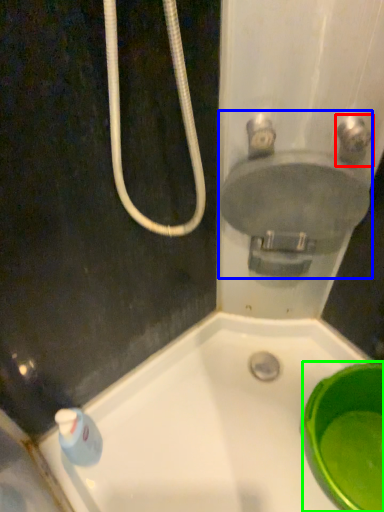
Question: Which is farther away from plumbing fixture (highlighted by a red box)? sink (highlighted by a blue box) or basin (highlighted by a green box)?

Choices:
 (A) sink
 (B) basin

Answer: (B)